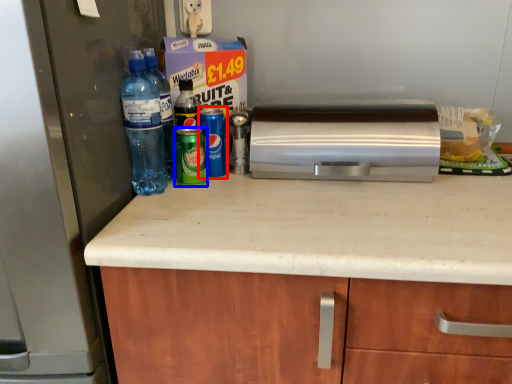
Question: Among these objects, which one is farthest to the camera, bottle (highlighted by a red box) or beverage (highlighted by a blue box)?

Choices:
 (A) bottle
 (B) beverage

Answer: (A)